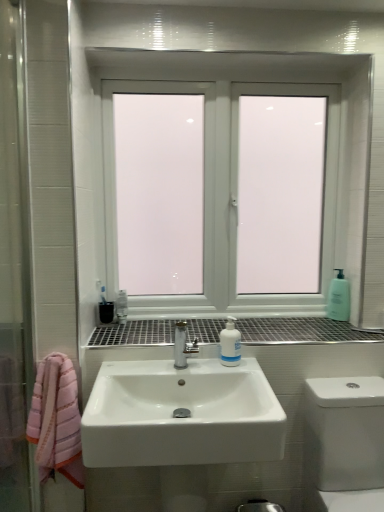
Question: Would you consider white plastic bottle at center to be distant from white glossy sink at center?

Choices:
 (A) yes
 (B) no

Answer: (B)

Question: From the image's perspective, does white plastic bottle at center appear lower than white glossy sink at center?

Choices:
 (A) yes
 (B) no

Answer: (B)

Question: Is white plastic bottle at center outside of white glossy sink at center?

Choices:
 (A) yes
 (B) no

Answer: (B)

Question: Considering the relative positions of white plastic bottle at center and white glossy sink at center in the image provided, is white plastic bottle at center to the left of white glossy sink at center from the viewer's perspective?

Choices:
 (A) yes
 (B) no

Answer: (B)

Question: Is white glossy sink at center located within white plastic bottle at center?

Choices:
 (A) yes
 (B) no

Answer: (B)

Question: Does white plastic bottle at center have a larger size compared to white glossy sink at center?

Choices:
 (A) no
 (B) yes

Answer: (A)

Question: Does white glossy toilet at lower right appear on the left side of translucent plastic soap dispenser at right?

Choices:
 (A) yes
 (B) no

Answer: (A)

Question: Is translucent plastic soap dispenser at right inside white glossy toilet at lower right?

Choices:
 (A) yes
 (B) no

Answer: (B)

Question: From the image's perspective, is white glossy toilet at lower right over translucent plastic soap dispenser at right?

Choices:
 (A) no
 (B) yes

Answer: (A)

Question: Is white glossy toilet at lower right oriented away from translucent plastic soap dispenser at right?

Choices:
 (A) yes
 (B) no

Answer: (B)

Question: Is white glossy toilet at lower right behind translucent plastic soap dispenser at right?

Choices:
 (A) yes
 (B) no

Answer: (B)

Question: Is white glossy toilet at lower right outside of translucent plastic soap dispenser at right?

Choices:
 (A) no
 (B) yes

Answer: (B)

Question: Considering the relative sizes of translucent plastic soap dispenser at right and white glossy sink at center in the image provided, is translucent plastic soap dispenser at right shorter than white glossy sink at center?

Choices:
 (A) yes
 (B) no

Answer: (A)